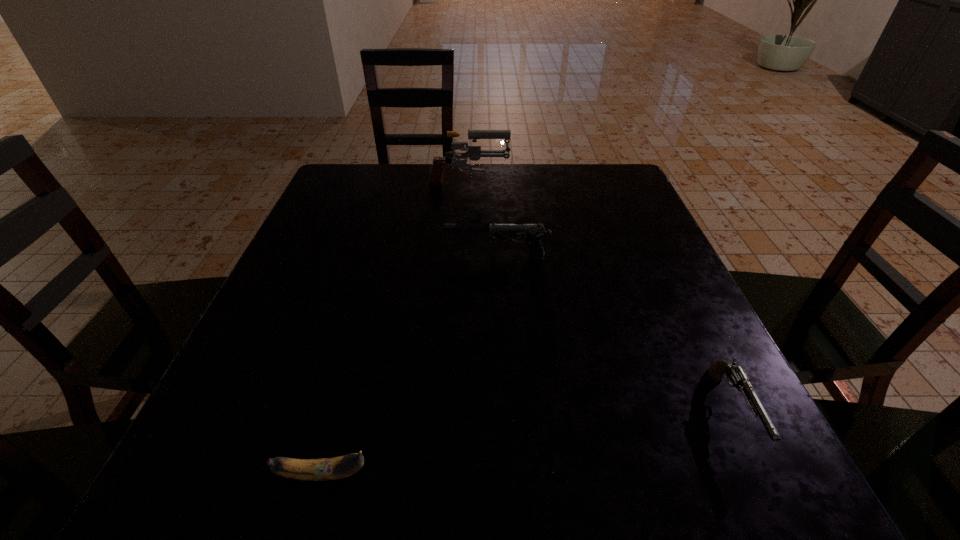
Identify the location of blank area at the far edge. The width and height of the screenshot is (960, 540). (407, 166).

Image resolution: width=960 pixels, height=540 pixels. What are the coordinates of `blank space at the near edge of the desktop` in the screenshot? It's located at (324, 451).

I want to click on vacant space at the left edge of the desktop, so click(x=292, y=288).

Where is `vacant space at the right edge of the desktop`? The height and width of the screenshot is (540, 960). vacant space at the right edge of the desktop is located at coordinates (655, 349).

Locate an element on the screen. vacant area between the second farthest gun and the rightmost object is located at coordinates (614, 334).

The width and height of the screenshot is (960, 540). I want to click on unoccupied area between the nearest gun and the third shortest object, so click(614, 334).

You are a GUI agent. You are given a task and a screenshot of the screen. Output one action in this format:
    pyautogui.click(x=<x>, y=<y>)
    Task: Click on the free space between the leftmost object and the rightmost object
    
    Given the screenshot: What is the action you would take?
    pyautogui.click(x=528, y=443)

Locate an element on the screen. The height and width of the screenshot is (540, 960). unoccupied position between the tallest gun and the second nearest object is located at coordinates (600, 299).

Locate an element on the screen. This screenshot has width=960, height=540. vacant area between the banana and the farthest gun is located at coordinates (396, 331).

You are a GUI agent. You are given a task and a screenshot of the screen. Output one action in this format:
    pyautogui.click(x=<x>, y=<y>)
    Task: Click on the free spot between the nearest gun and the banana
    
    Given the screenshot: What is the action you would take?
    pyautogui.click(x=528, y=443)